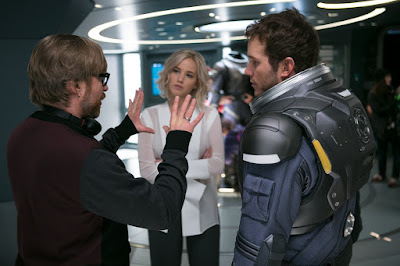
Image resolution: width=400 pixels, height=266 pixels. I want to click on floor, so click(371, 260).